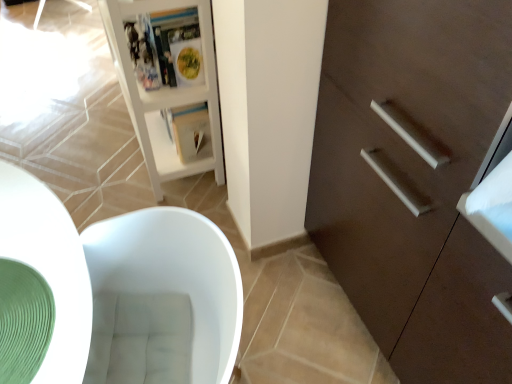
Question: Would you say dark brown wood cabinet at right is inside or outside white glossy bookshelf at upper left?

Choices:
 (A) outside
 (B) inside

Answer: (A)

Question: Is dark brown wood cabinet at right wider or thinner than white glossy bookshelf at upper left?

Choices:
 (A) wide
 (B) thin

Answer: (A)

Question: Based on their relative distances, which object is nearer to the white paper magazine at center, the second magazine positioned from the front?

Choices:
 (A) white glossy bookshelf at upper left
 (B) green rubber mat at lower left
 (C) matte plastic magazine at upper center, which is the 1th magazine from front to back
 (D) dark brown wood cabinet at right

Answer: (A)

Question: Estimate the real-world distances between objects in this image. Which object is closer to the white paper magazine at center, the second magazine positioned from the front?

Choices:
 (A) white glossy bookshelf at upper left
 (B) green rubber mat at lower left
 (C) matte plastic magazine at upper center, which ranks as the 2th magazine in back-to-front order
 (D) dark brown wood cabinet at right

Answer: (A)